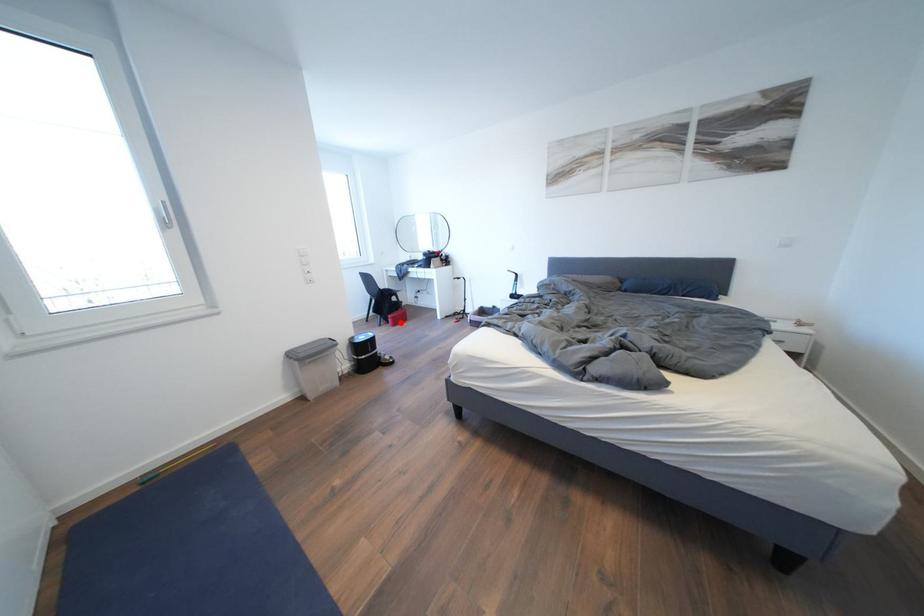
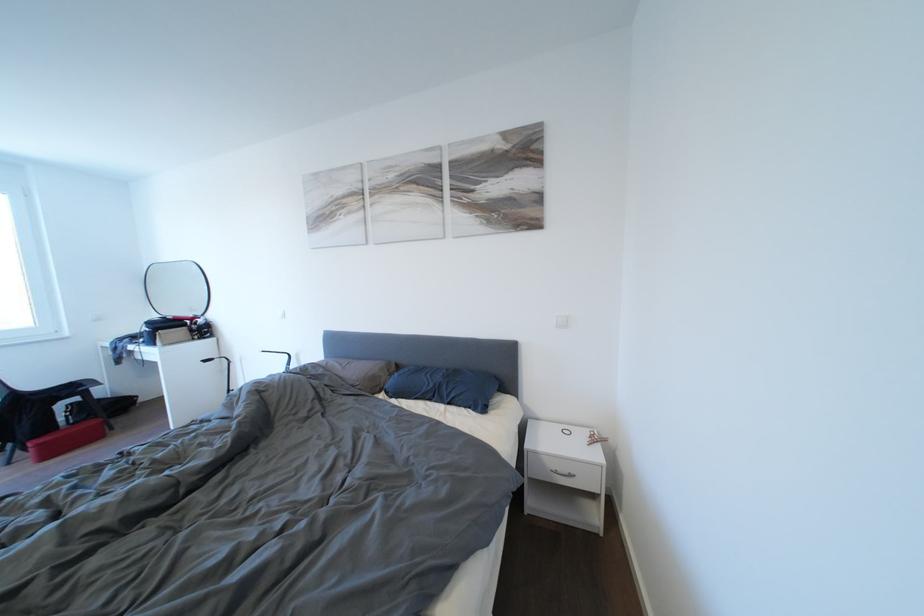
Find the pixel in the second image that matches the highlighted location in the first image.

(46, 450)